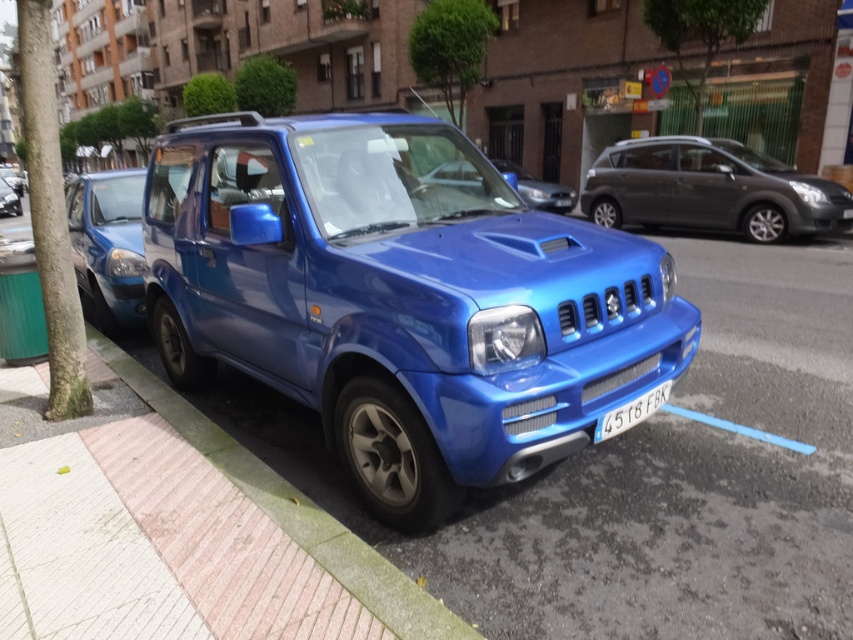
Question: Is brick at lower left smaller than metallic blue car at center?

Choices:
 (A) yes
 (B) no

Answer: (A)

Question: Does brick at lower left appear over metallic blue car at center?

Choices:
 (A) no
 (B) yes

Answer: (A)

Question: Is metallic gray minivan at center wider than white plastic license plate at center?

Choices:
 (A) no
 (B) yes

Answer: (B)

Question: Which of the following is the farthest from the observer?

Choices:
 (A) (13, 214)
 (B) (654, 396)

Answer: (A)

Question: Which object appears farthest from the camera in this image?

Choices:
 (A) metallic blue jeep at center
 (B) metallic blue suv at left

Answer: (B)

Question: Which is farther from the metallic blue jeep at center?

Choices:
 (A) metallic gray minivan at center
 (B) white plastic license plate at center

Answer: (A)